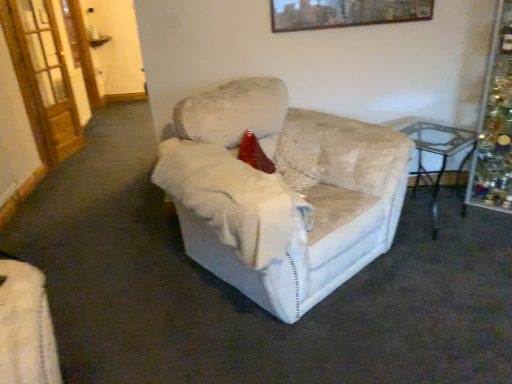
Question: From the image's perspective, is velvet beige armchair at center located above or below transparent glass table at right?

Choices:
 (A) below
 (B) above

Answer: (A)

Question: Is velvet beige armchair at center situated inside transparent glass table at right or outside?

Choices:
 (A) inside
 (B) outside

Answer: (B)

Question: Which of these objects is positioned farthest from the transparent glass table at right?

Choices:
 (A) wooden framed artwork at upper center
 (B) velvet red pillow at center
 (C) wooden door at left
 (D) velvet beige armchair at center
 (E) shiny metallic tinsel at right

Answer: (C)

Question: Based on their relative distances, which object is farther from the shiny metallic tinsel at right?

Choices:
 (A) transparent glass table at right
 (B) velvet beige armchair at center
 (C) velvet red pillow at center
 (D) wooden framed artwork at upper center
 (E) wooden door at left

Answer: (E)